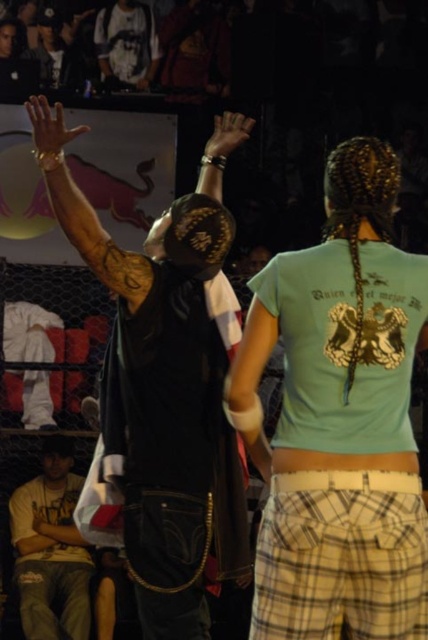
Is green fabric shirt at center wider than dark skin tattooed arm at upper left?

Indeed, green fabric shirt at center has a greater width compared to dark skin tattooed arm at upper left.

Between point (353, 356) and point (27, 100), which one is positioned in front?

Point (353, 356)

At what (x,y) coordinates should I click in order to perform the action: click on green fabric shirt at center. Please return your answer as a coordinate pair (x, y). The width and height of the screenshot is (428, 640). Looking at the image, I should click on (338, 419).

Can you confirm if denim pants at lower left is shorter than matte black hand at upper center?

Incorrect, denim pants at lower left's height does not fall short of matte black hand at upper center's.

Is the position of denim pants at lower left less distant than that of matte black hand at upper center?

No, denim pants at lower left is further to the viewer.

Image resolution: width=428 pixels, height=640 pixels. In order to click on denim pants at lower left in this screenshot , I will do pyautogui.click(x=51, y=550).

Is point (118, 48) farther from camera compared to point (208, 140)?

No.

Who is taller, white fabric shirt at upper center or matte black hand at upper center?

With more height is white fabric shirt at upper center.

This screenshot has width=428, height=640. In order to click on white fabric shirt at upper center in this screenshot , I will do `click(127, 44)`.